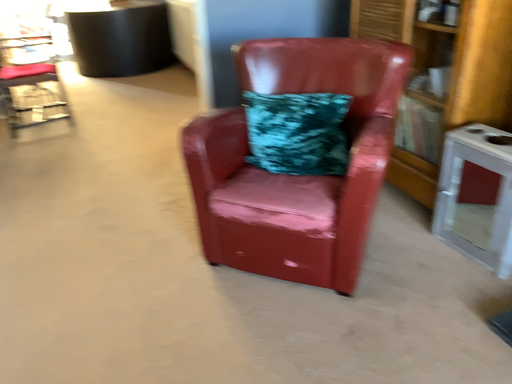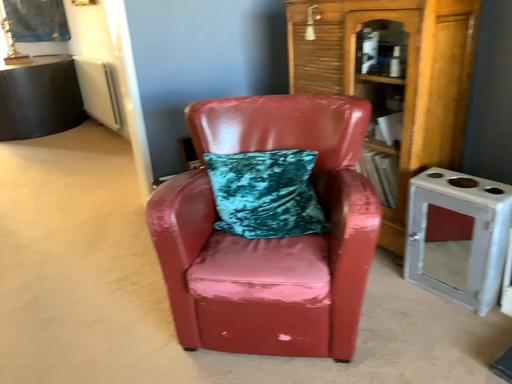
Question: Which way did the camera rotate in the video?

Choices:
 (A) rotated upward
 (B) rotated downward

Answer: (A)